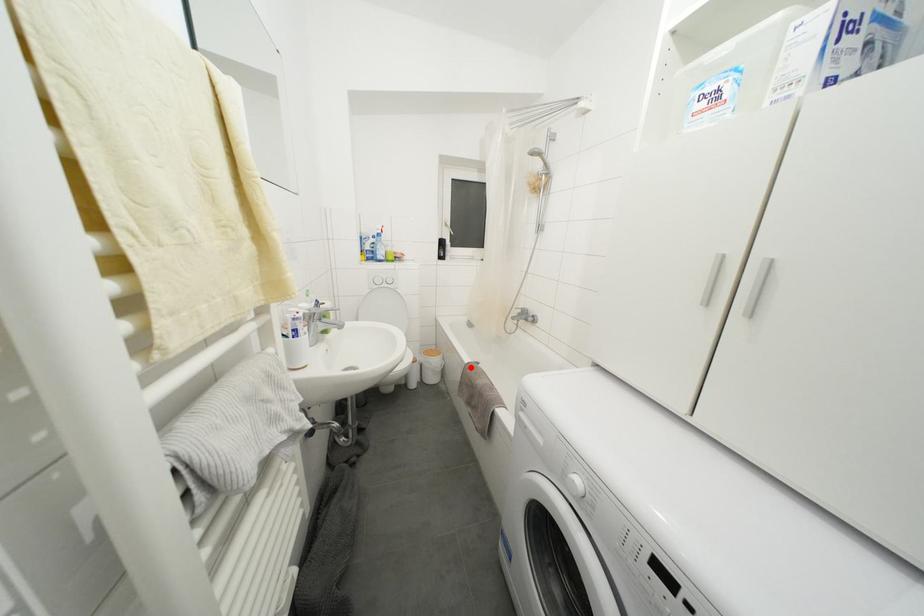
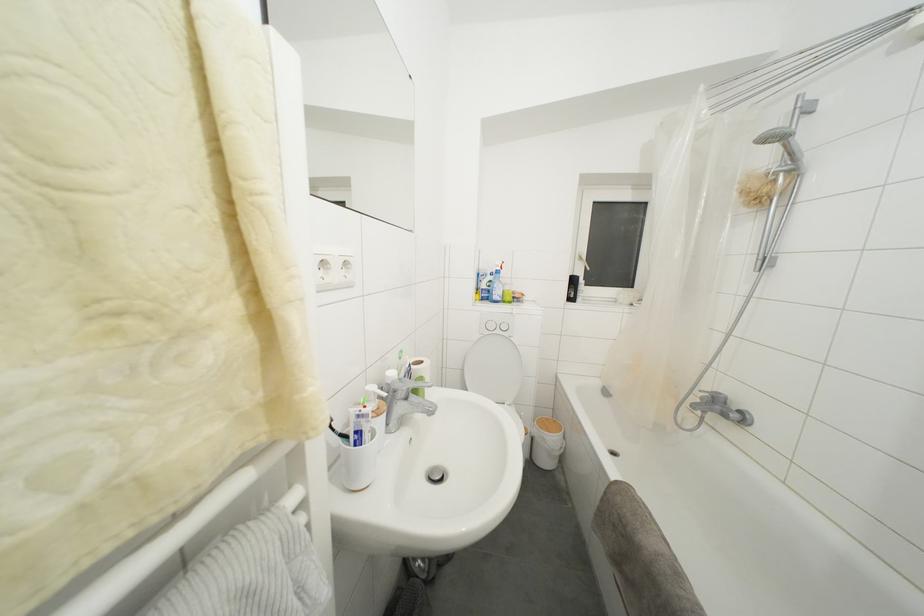
Where in the second image is the point corresponding to the highlighted location from the first image?

(617, 484)